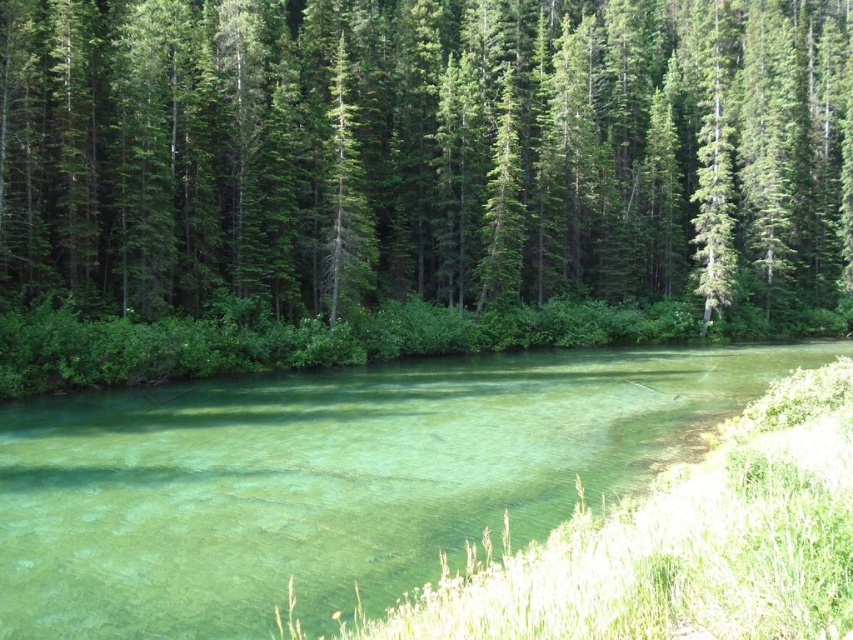
You are standing on the grassy bank on the right side of the image. You want to walk to the clear glassy water at center. Which direction should you walk to avoid the green textured trees at upper center?

Since the green textured trees at upper center are above the clear glassy water at center, you should walk towards the lower area away from the trees to reach the water without encountering them.

You are standing at the edge of the water and want to reach the green textured trees at upper center. The clear glassy water at center is between you and the trees. Can you walk directly across the water to reach the trees?

The green textured trees at upper center and clear glassy water at center are 111.19 feet apart. Since the clear glassy water at center is between you and the trees, you would have to walk 111.19 feet across the water to reach the trees.